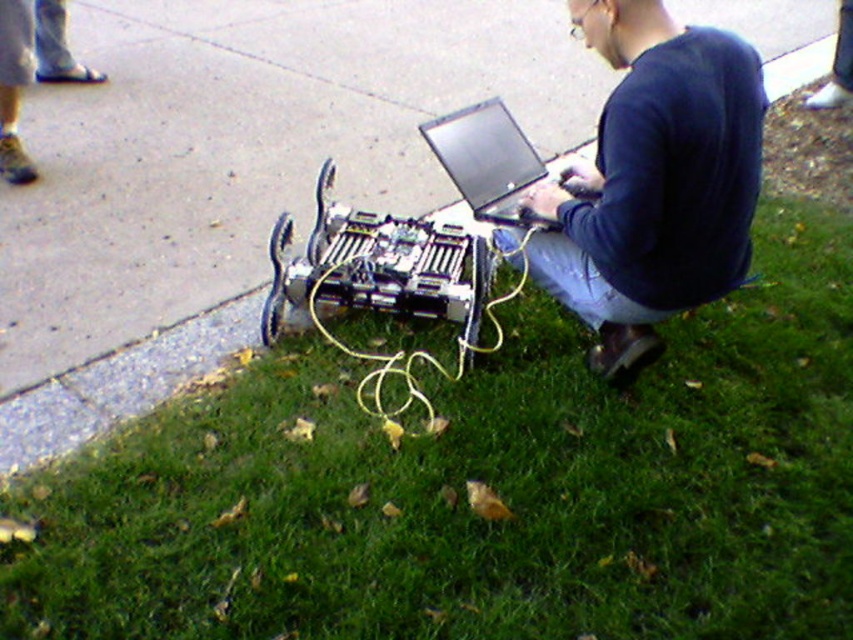
Question: Does green grass at lower right appear on the right side of black glossy laptop at center?

Choices:
 (A) no
 (B) yes

Answer: (B)

Question: Based on their relative distances, which object is farther from the concrete at lower left?

Choices:
 (A) dark blue long-sleeve shirt at center
 (B) black glossy laptop at center

Answer: (B)

Question: Which of the following is the closest to the observer?

Choices:
 (A) concrete at lower left
 (B) black glossy laptop at center
 (C) green grass at lower right

Answer: (C)

Question: Can you confirm if green grass at lower right is bigger than concrete at lower left?

Choices:
 (A) no
 (B) yes

Answer: (A)

Question: From the image, what is the correct spatial relationship of concrete at lower left in relation to black glossy laptop at center?

Choices:
 (A) above
 (B) below

Answer: (A)

Question: Which of the following is the closest to the observer?

Choices:
 (A) green grass at lower right
 (B) dark blue long-sleeve shirt at center

Answer: (A)